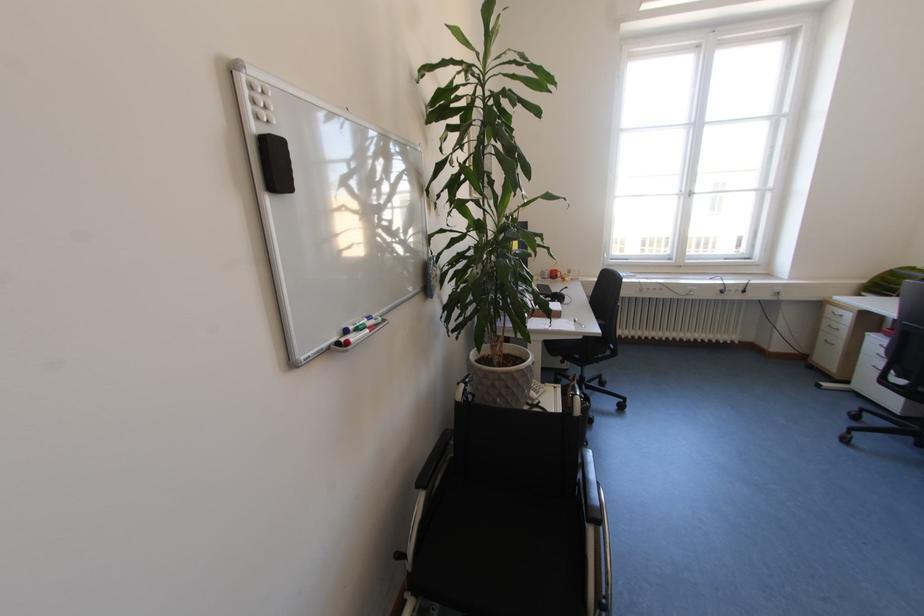
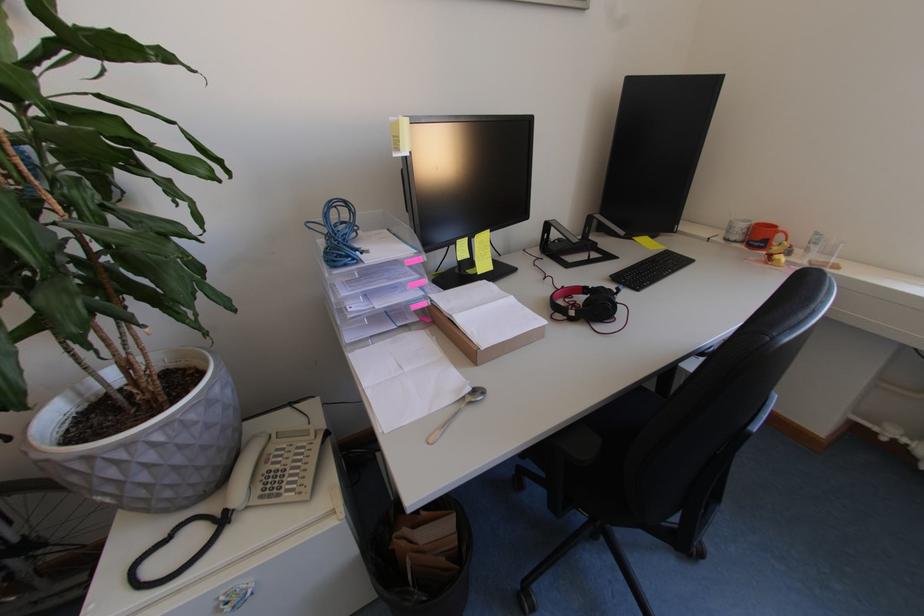
The point at (578, 277) is marked in the first image. Where is the corresponding point in the second image?

(816, 253)